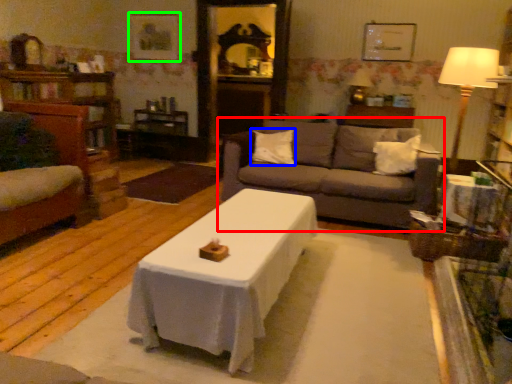
Question: Which object is the farthest from studio couch (highlighted by a red box)? Choose among these: pillow (highlighted by a blue box) or picture frame (highlighted by a green box).

Choices:
 (A) pillow
 (B) picture frame

Answer: (B)